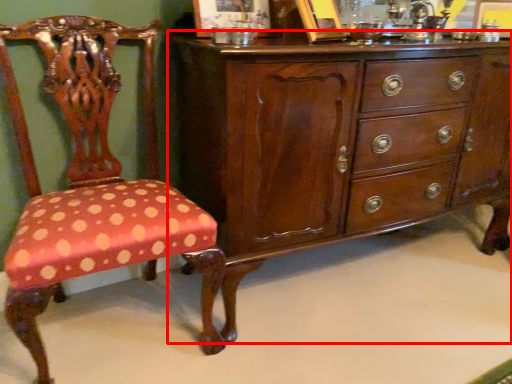
Question: From the image's perspective, what is the correct spatial positioning of chest of drawers (annotated by the red box) in reference to chair?

Choices:
 (A) below
 (B) above

Answer: (B)